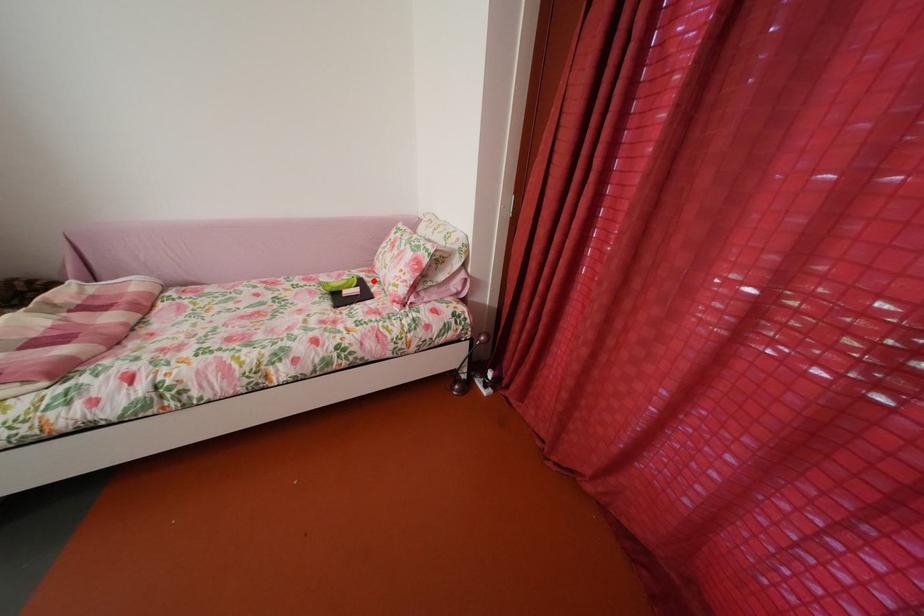
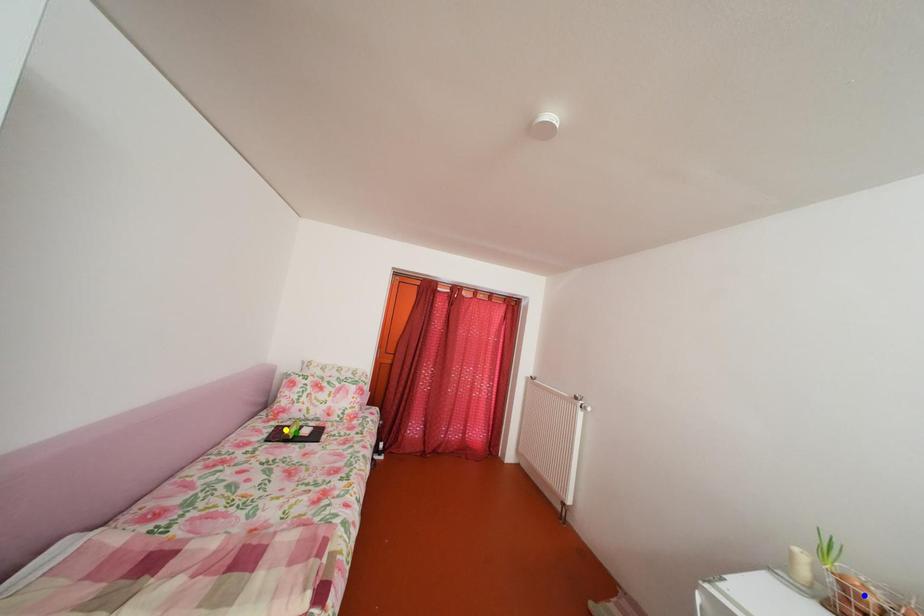
Question: I am providing you with two images of the same scene from different viewpoints. A red point is marked on the first image. You are given multiple points on the second image. Which point in image 2 represents the same 3d spot as the red point in image 1?

Choices:
 (A) yellow point
 (B) green point
 (C) blue point

Answer: (A)